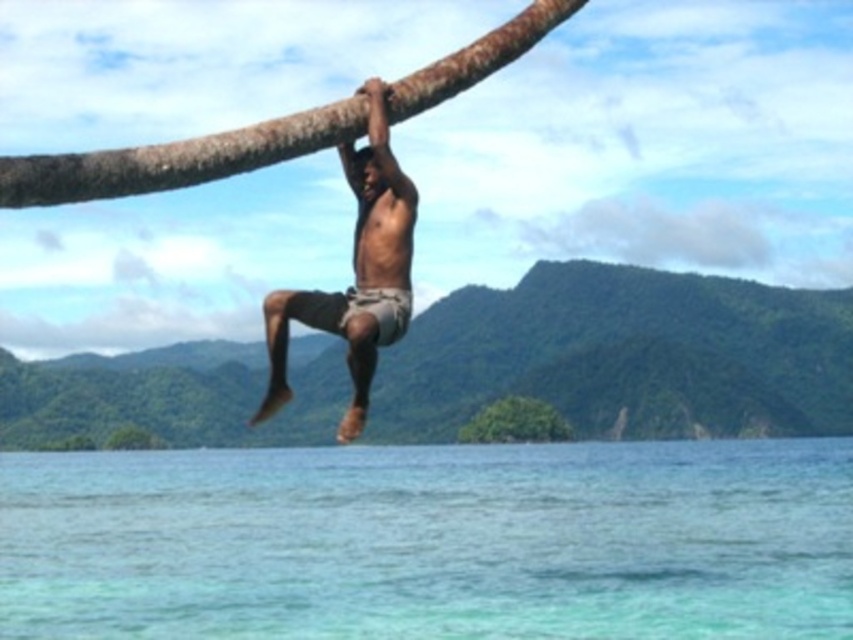
Based on the scene description, where is the clear blue water at lower center located in terms of coordinates?

The clear blue water at lower center is located at coordinates point [431,541].

You are a safety inspector evaluating the scene. The clear blue water at lower center has a strong current, and the brown textured shorts at center belong to a person hanging from a palm tree trunk. What is the minimum safe distance required between the person and the water to prevent them from being pulled in by the current?

The clear blue water at lower center and brown textured shorts at center are 787.19 feet apart from each other, so the current is not a threat since the distance is sufficient to keep the person safe.